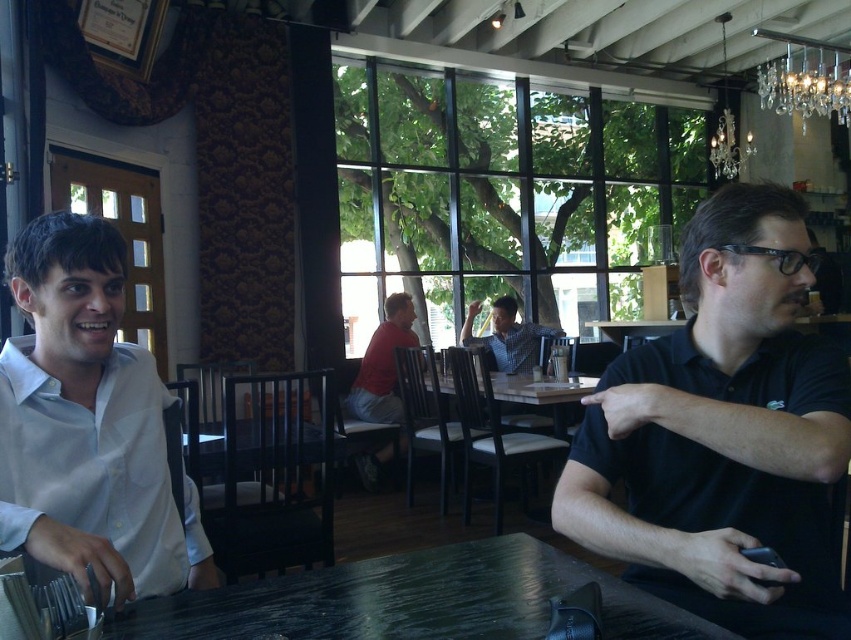
From the picture: Between checkered shirt at center and swarthy crystal chandelier at upper right, which one appears on the left side from the viewer's perspective?

From the viewer's perspective, checkered shirt at center appears more on the left side.

Is checkered shirt at center above swarthy crystal chandelier at upper right?

Incorrect, checkered shirt at center is not positioned above swarthy crystal chandelier at upper right.

Is point (489, 340) more distant than point (714, 134)?

No, it is in front of (714, 134).

At what (x,y) coordinates should I click in order to perform the action: click on checkered shirt at center. Please return your answer as a coordinate pair (x, y). The width and height of the screenshot is (851, 640). Looking at the image, I should click on (507, 336).

Does point (161, 576) come behind point (784, 100)?

No, (161, 576) is closer to viewer.

Between white smooth shirt at left and crystal glass chandelier at upper right, which one has less height?

Standing shorter between the two is white smooth shirt at left.

The height and width of the screenshot is (640, 851). Identify the location of white smooth shirt at left. (89, 424).

The height and width of the screenshot is (640, 851). I want to click on white smooth shirt at left, so click(89, 424).

The height and width of the screenshot is (640, 851). Find the location of `black matte shirt at right`. black matte shirt at right is located at coordinates (723, 435).

Who is shorter, black matte shirt at right or black marble table at center?

black marble table at center

Find the location of a particular element. This screenshot has height=640, width=851. black matte shirt at right is located at coordinates coord(723,435).